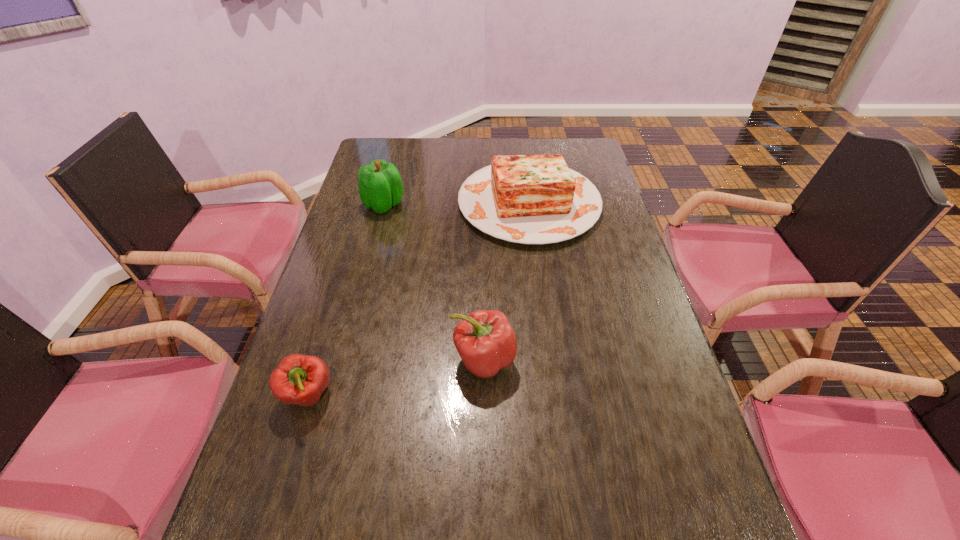
Find the location of a particular element. object that is at the far right corner is located at coordinates (530, 199).

This screenshot has width=960, height=540. In order to click on free location at the far edge of the desktop in this screenshot , I will do `click(407, 158)`.

Where is `vacant space at the left edge`? The height and width of the screenshot is (540, 960). vacant space at the left edge is located at coordinates (311, 484).

The height and width of the screenshot is (540, 960). I want to click on vacant point at the right edge, so click(588, 294).

The image size is (960, 540). In order to click on vacant space at the far right corner in this screenshot , I will do `click(572, 156)`.

Find the location of `free space that is in between the farthest bell pepper and the shortest bell pepper`. free space that is in between the farthest bell pepper and the shortest bell pepper is located at coordinates (347, 300).

The width and height of the screenshot is (960, 540). I want to click on vacant space in between the farthest bell pepper and the rightmost bell pepper, so click(x=434, y=282).

Locate an element on the screen. Image resolution: width=960 pixels, height=540 pixels. vacant space that's between the rightmost bell pepper and the farthest bell pepper is located at coordinates [x=434, y=282].

In order to click on free space between the shortest object and the farthest bell pepper in this screenshot , I will do `click(347, 300)`.

Where is `free spot between the shortest object and the rightmost bell pepper`? This screenshot has height=540, width=960. free spot between the shortest object and the rightmost bell pepper is located at coordinates point(396,377).